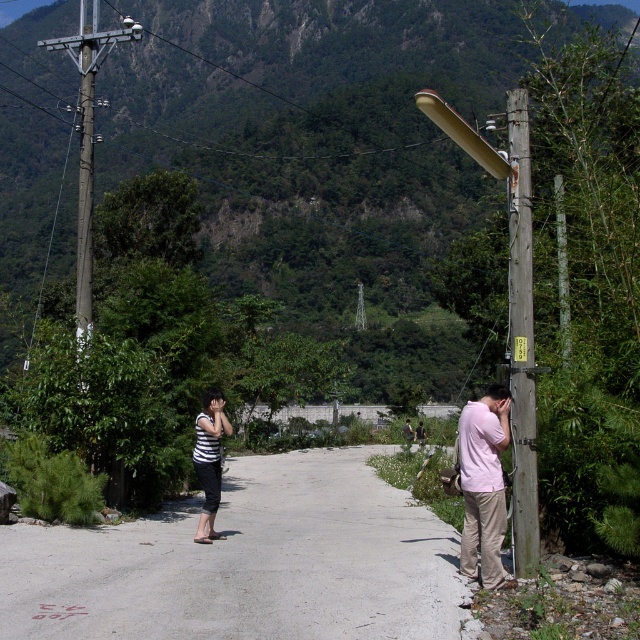
You are a photographer trying to capture a group photo of the pink matte shirt at right and the striped fabric shirt at center. Since you want to avoid having one person appear too much taller than the other, which person should stand closer to the camera to balance their sizes in the photo?

The pink matte shirt at right is much taller than the striped fabric shirt at center. To balance their sizes in the photo, the striped fabric shirt at center should stand closer to the camera to appear larger, while the pink matte shirt at right should stand farther back to appear smaller.

What are the coordinates of the striped fabric shirt at center?

The striped fabric shirt at center is located at point (209, 460).

You are a delivery drone flying above the rural scene. You need to drop a package at point A and point B. Point A is at coordinates point [216,396] and point B is at point [404,429]. According to the scene description, which point is closer to the delivery drone when flying directly above the utility poles?

Point A at coordinates point [216,396] is closer to the delivery drone when flying directly above the utility poles because it is in front of point B at point [404,429].